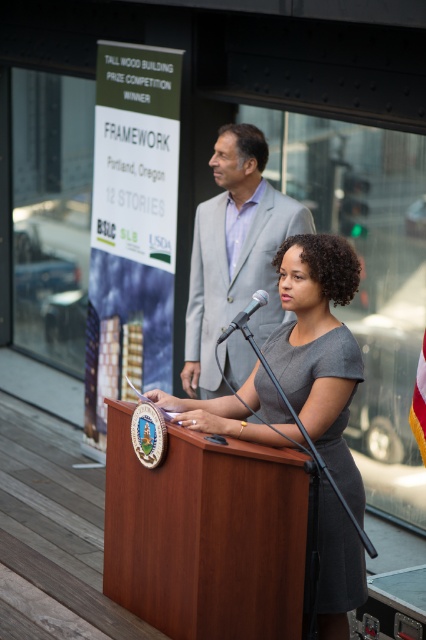
Question: Can you confirm if mahogany wood podium at center is positioned below gray suit at upper center?

Choices:
 (A) yes
 (B) no

Answer: (A)

Question: Can you confirm if gray matte dress at center is bigger than metallic silver microphone at center?

Choices:
 (A) yes
 (B) no

Answer: (A)

Question: Which object is the closest to the gray suit at upper center?

Choices:
 (A) metallic silver microphone at center
 (B) mahogany wood podium at center
 (C) gray matte dress at center

Answer: (C)

Question: Does mahogany wood podium at center come in front of gray suit at upper center?

Choices:
 (A) yes
 (B) no

Answer: (A)

Question: Which object appears farthest from the camera in this image?

Choices:
 (A) metallic silver microphone at center
 (B) gray suit at upper center

Answer: (B)

Question: Which object is the closest to the gray suit at upper center?

Choices:
 (A) mahogany wood podium at center
 (B) metallic silver microphone at center
 (C) gray matte dress at center

Answer: (C)